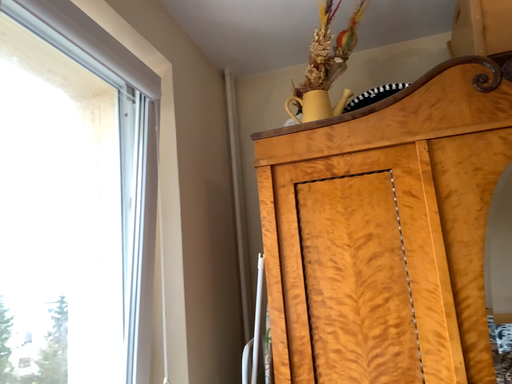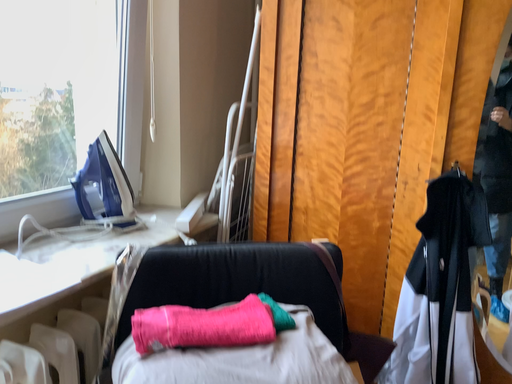
Question: How did the camera likely rotate when shooting the video?

Choices:
 (A) rotated right
 (B) rotated left

Answer: (B)